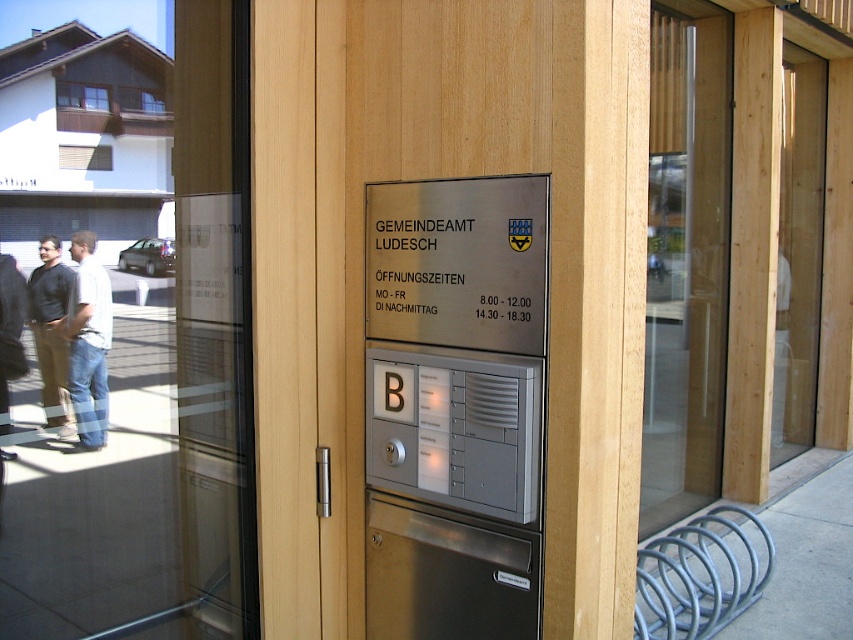
Question: Based on their relative distances, which object is nearer to the transparent glass door at center?

Choices:
 (A) metallic silver door at center
 (B) metallic silver sign at center
 (C) dark brown pants at left
 (D) denim jeans at left

Answer: (A)

Question: Does denim jeans at left have a lesser width compared to dark brown pants at left?

Choices:
 (A) yes
 (B) no

Answer: (B)

Question: Can you confirm if denim jeans at left is positioned to the right of dark brown pants at left?

Choices:
 (A) no
 (B) yes

Answer: (B)

Question: Which object is positioned closest to the denim jeans at left?

Choices:
 (A) transparent glass door at center
 (B) metallic silver door at center
 (C) metallic silver sign at center
 (D) dark brown pants at left

Answer: (D)

Question: Can you confirm if metallic silver door at center is positioned above dark brown pants at left?

Choices:
 (A) no
 (B) yes

Answer: (A)

Question: Based on their relative distances, which object is nearer to the metallic silver sign at center?

Choices:
 (A) denim jeans at left
 (B) dark brown pants at left
 (C) metallic silver door at center
 (D) transparent glass door at center

Answer: (C)